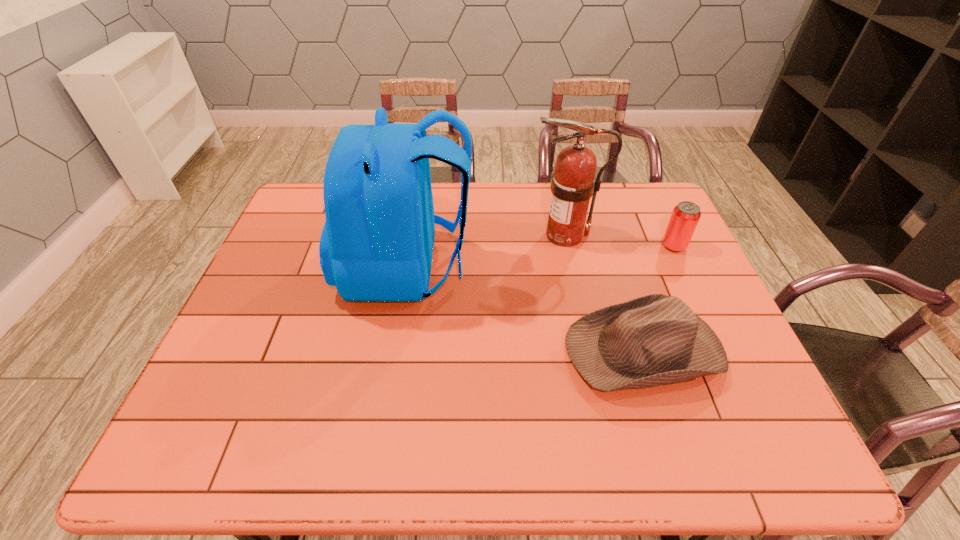
Locate an element on the screen. Image resolution: width=960 pixels, height=540 pixels. free location that satisfies the following two spatial constraints: 1. on the back of the fedora; 2. on the right side of the leftmost object is located at coordinates (x=394, y=348).

Where is `blank space that satisfies the following two spatial constraints: 1. at the nozzle of the fire extinguisher; 2. on the left side of the fedora`? This screenshot has width=960, height=540. blank space that satisfies the following two spatial constraints: 1. at the nozzle of the fire extinguisher; 2. on the left side of the fedora is located at coordinates (588, 348).

Locate an element on the screen. free space that satisfies the following two spatial constraints: 1. at the nozzle of the can; 2. on the right side of the fire extinguisher is located at coordinates (567, 246).

At what (x,y) coordinates should I click in order to perform the action: click on free spot that satisfies the following two spatial constraints: 1. on the back of the backpack; 2. on the left side of the fedora. Please return your answer as a coordinate pair (x, y). This screenshot has width=960, height=540. Looking at the image, I should click on (394, 348).

I want to click on vacant space that satisfies the following two spatial constraints: 1. on the back of the leftmost object; 2. on the back side of the fedora, so click(x=394, y=348).

Locate an element on the screen. The image size is (960, 540). blank space that satisfies the following two spatial constraints: 1. at the nozzle of the fedora; 2. on the left side of the fire extinguisher is located at coordinates point(588,348).

Find the location of a particular element. The image size is (960, 540). blank area in the image that satisfies the following two spatial constraints: 1. on the back side of the fedora; 2. on the back of the leftmost object is located at coordinates (617, 266).

Where is `free location that satisfies the following two spatial constraints: 1. at the nozzle of the can; 2. on the left side of the fire extinguisher`? The width and height of the screenshot is (960, 540). free location that satisfies the following two spatial constraints: 1. at the nozzle of the can; 2. on the left side of the fire extinguisher is located at coordinates (567, 246).

You are a GUI agent. You are given a task and a screenshot of the screen. Output one action in this format:
    pyautogui.click(x=<x>, y=<y>)
    Task: Click on the vacant position in the image that satisfies the following two spatial constraints: 1. on the back side of the fedora; 2. on the back of the backpack
    
    Given the screenshot: What is the action you would take?
    pyautogui.click(x=617, y=266)